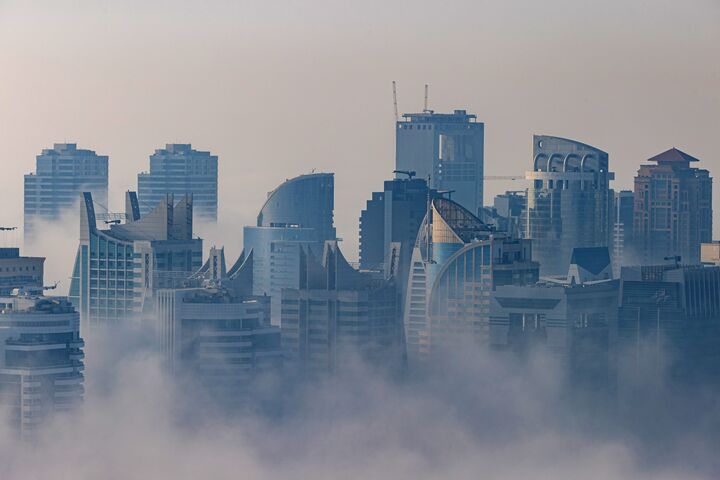
The width and height of the screenshot is (720, 480). Identify the location of hvac. (45, 305), (9, 310).